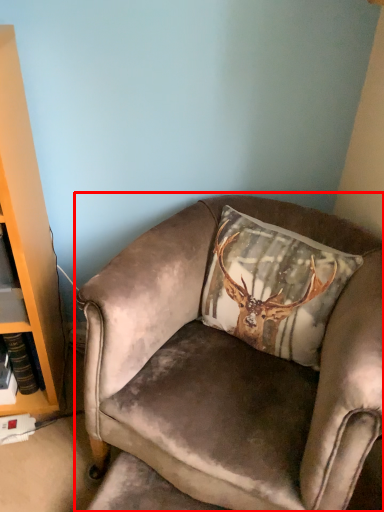
Question: Observing the image, what is the correct spatial positioning of chair (annotated by the red box) in reference to pillow?

Choices:
 (A) right
 (B) left

Answer: (B)